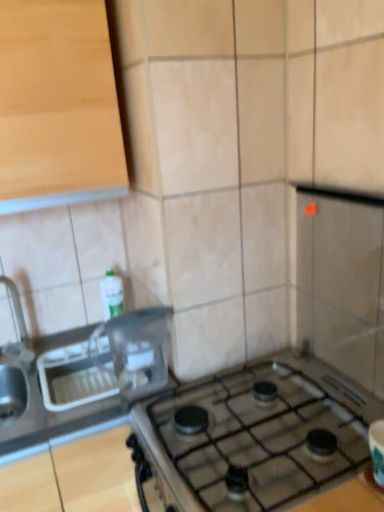
Question: Considering the relative sizes of brushed metal faucet at left and light wood cabinet at upper left in the image provided, is brushed metal faucet at left smaller than light wood cabinet at upper left?

Choices:
 (A) yes
 (B) no

Answer: (A)

Question: Can we say brushed metal faucet at left lies outside light wood cabinet at upper left?

Choices:
 (A) yes
 (B) no

Answer: (A)

Question: From a real-world perspective, is brushed metal faucet at left over light wood cabinet at upper left?

Choices:
 (A) yes
 (B) no

Answer: (B)

Question: Is brushed metal faucet at left behind light wood cabinet at upper left?

Choices:
 (A) yes
 (B) no

Answer: (A)

Question: Is brushed metal faucet at left taller than light wood cabinet at upper left?

Choices:
 (A) no
 (B) yes

Answer: (A)

Question: Is brushed metal faucet at left shorter than light wood cabinet at upper left?

Choices:
 (A) yes
 (B) no

Answer: (A)

Question: Can you confirm if brushed metal faucet at left is taller than clear plastic container at center?

Choices:
 (A) no
 (B) yes

Answer: (B)

Question: Is the surface of brushed metal faucet at left in direct contact with clear plastic container at center?

Choices:
 (A) yes
 (B) no

Answer: (B)

Question: Can you confirm if brushed metal faucet at left is wider than clear plastic container at center?

Choices:
 (A) no
 (B) yes

Answer: (B)

Question: Would you say brushed metal faucet at left is outside clear plastic container at center?

Choices:
 (A) yes
 (B) no

Answer: (A)

Question: Considering the relative sizes of brushed metal faucet at left and clear plastic container at center in the image provided, is brushed metal faucet at left bigger than clear plastic container at center?

Choices:
 (A) yes
 (B) no

Answer: (A)

Question: Is brushed metal faucet at left closer to camera compared to clear plastic container at center?

Choices:
 (A) yes
 (B) no

Answer: (B)

Question: Is satin silver sink at left at the back of brushed metal faucet at left?

Choices:
 (A) no
 (B) yes

Answer: (A)